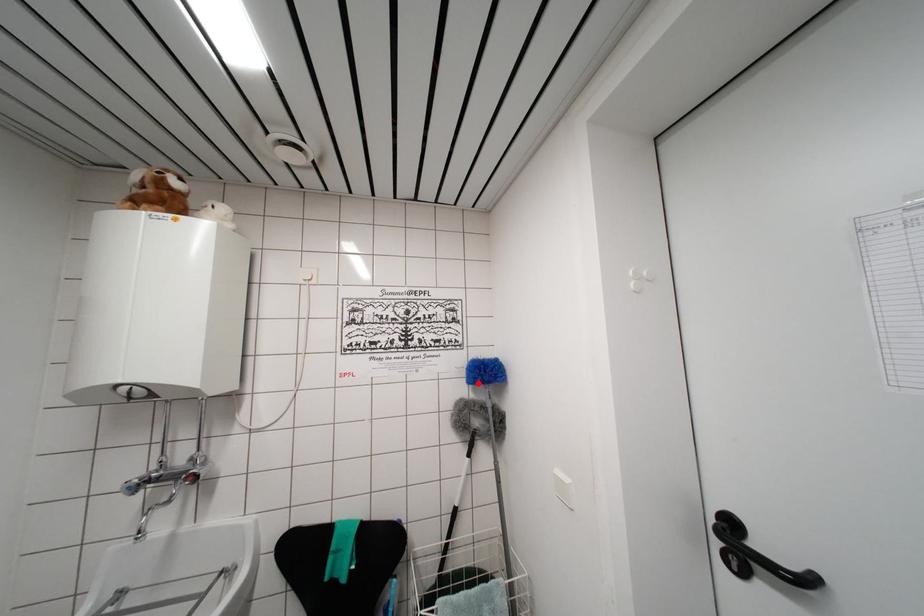
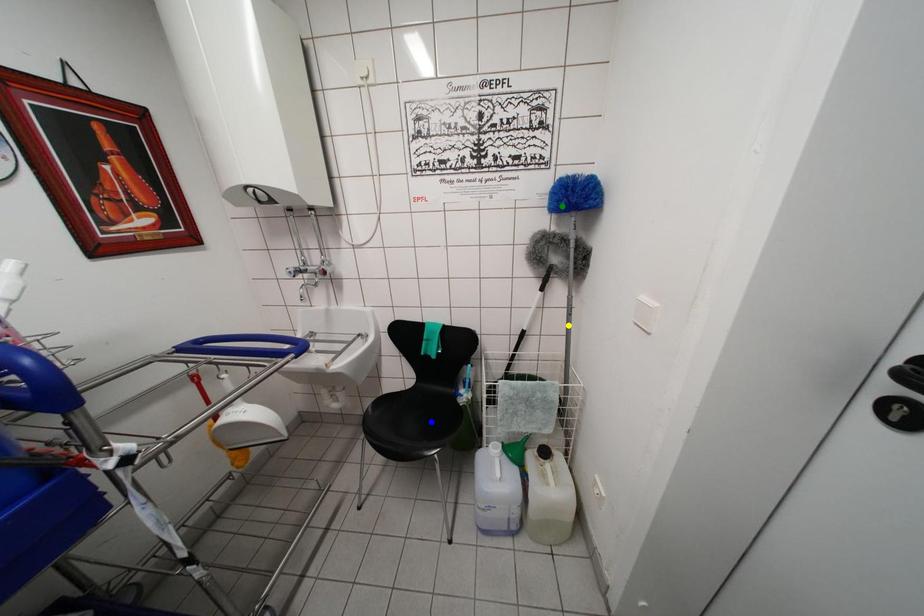
Question: I am providing you with two images of the same scene from different viewpoints. A red point is marked on the first image. You are given multiple points on the second image. Can you choose the point in image 2 that corresponds to the point in image 1?

Choices:
 (A) yellow point
 (B) blue point
 (C) green point

Answer: (C)